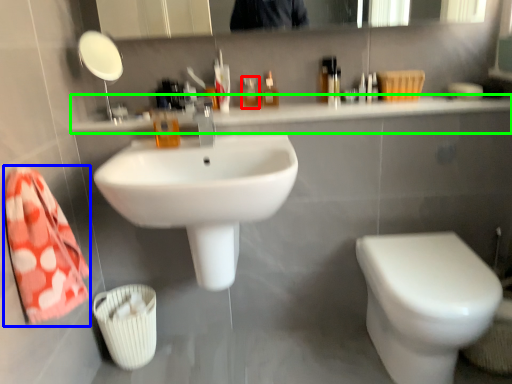
Question: Estimate the real-world distances between objects in this image. Which object is farther from mouthwash (highlighted by a red box), bath towel (highlighted by a blue box) or counter top (highlighted by a green box)?

Choices:
 (A) bath towel
 (B) counter top

Answer: (A)